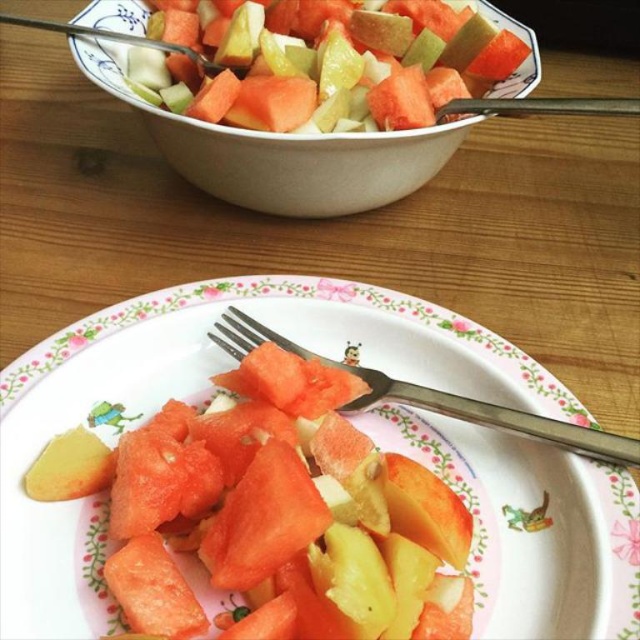
Can you confirm if silver metallic fork at center is thinner than yellow matte potato at lower left?

In fact, silver metallic fork at center might be wider than yellow matte potato at lower left.

Is silver metallic fork at center shorter than yellow matte potato at lower left?

Incorrect, silver metallic fork at center's height does not fall short of yellow matte potato at lower left's.

At what (x,y) coordinates should I click in order to perform the action: click on silver metallic fork at center. Please return your answer as a coordinate pair (x, y). The width and height of the screenshot is (640, 640). Looking at the image, I should click on pos(435,397).

Locate an element on the screen. silver metallic fork at center is located at coordinates tap(435, 397).

Does white ceramic bowl at upper center have a lesser width compared to yellow matte potato at lower left?

In fact, white ceramic bowl at upper center might be wider than yellow matte potato at lower left.

Measure the distance between white ceramic bowl at upper center and camera.

white ceramic bowl at upper center is 24.02 inches from camera.

The height and width of the screenshot is (640, 640). I want to click on white ceramic bowl at upper center, so point(282,152).

Who is lower down, smooth plastic plate at center or white ceramic bowl at upper center?

smooth plastic plate at center is lower down.

Can you confirm if smooth plastic plate at center is shorter than white ceramic bowl at upper center?

Yes, smooth plastic plate at center is shorter than white ceramic bowl at upper center.

Where is `smooth plastic plate at center`? This screenshot has height=640, width=640. smooth plastic plate at center is located at coordinates (202, 401).